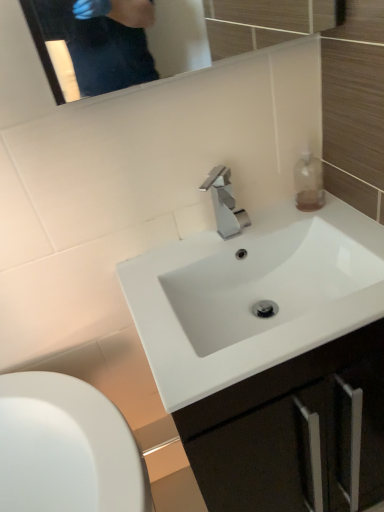
Locate an element on the screen. The height and width of the screenshot is (512, 384). free space to the left of polished metallic faucet at center is located at coordinates (180, 256).